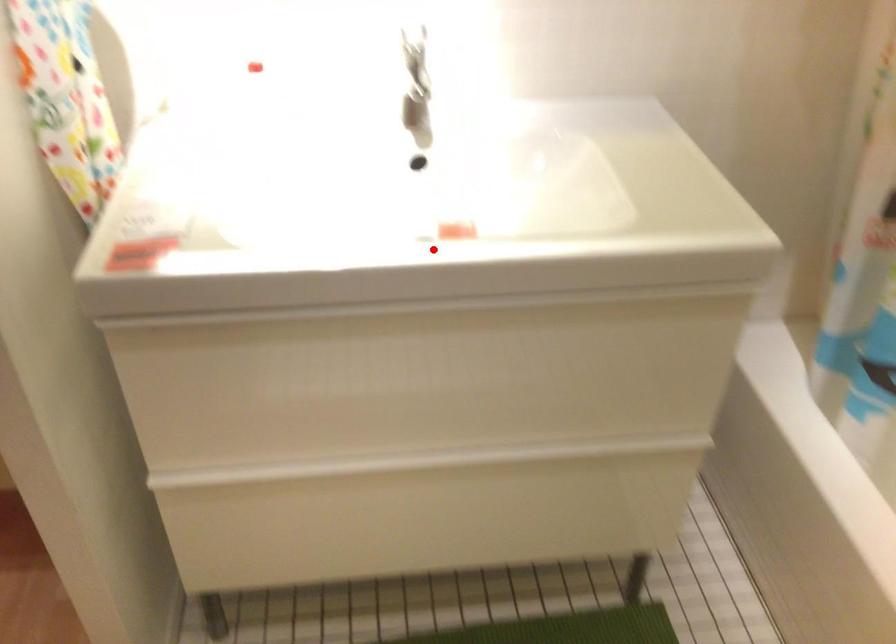
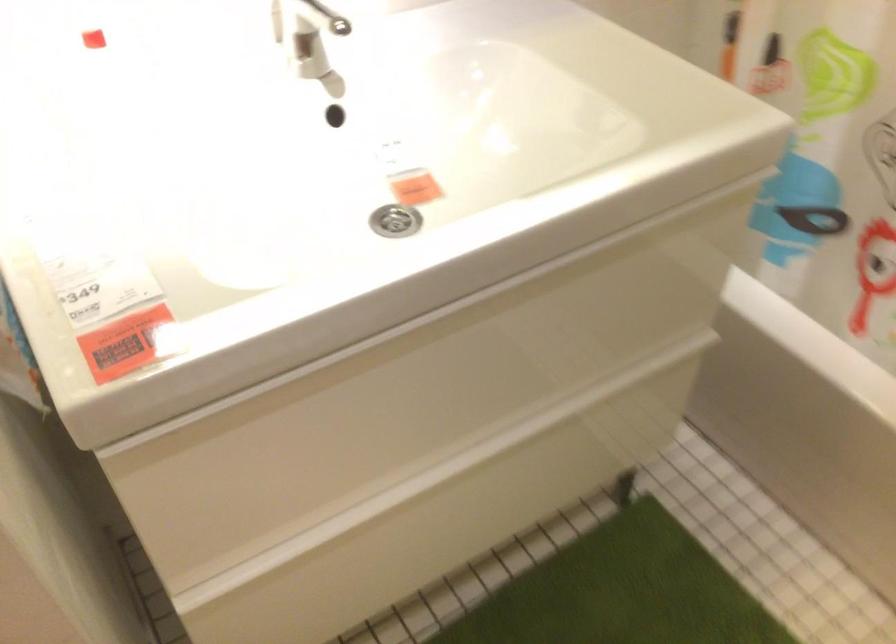
Locate, in the second image, the point that corresponds to the highlighted location in the first image.

(394, 221)